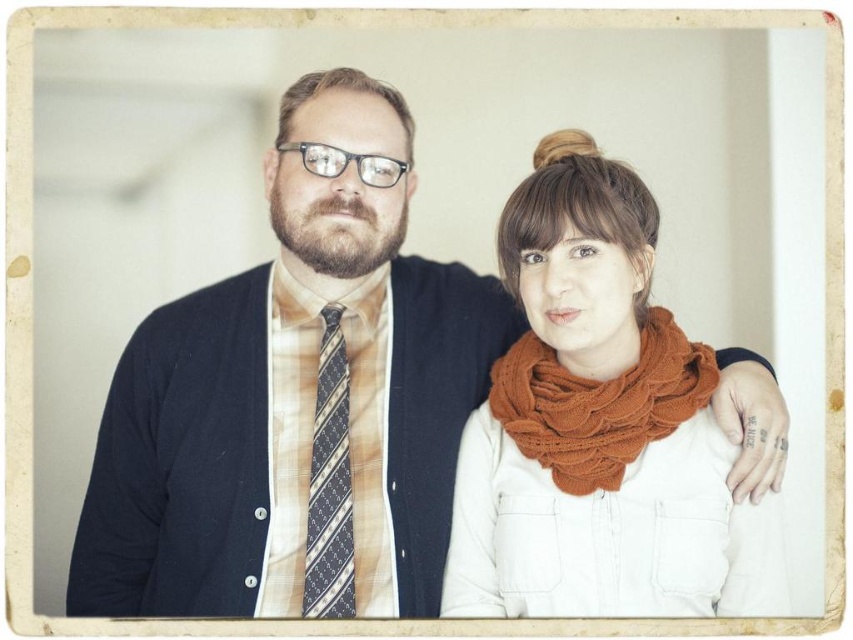
Question: Can you confirm if orange knitted scarf at center is positioned to the right of blue striped tie at center?

Choices:
 (A) yes
 (B) no

Answer: (A)

Question: Which point is farther to the camera?

Choices:
 (A) (346, 515)
 (B) (248, 550)
 (C) (766, 612)

Answer: (A)

Question: Does orange knitted scarf at center have a larger size compared to knitted orange scarf at center?

Choices:
 (A) no
 (B) yes

Answer: (B)

Question: Is knitted orange scarf at center to the left of blue striped tie at center from the viewer's perspective?

Choices:
 (A) yes
 (B) no

Answer: (B)

Question: Which object appears closest to the camera in this image?

Choices:
 (A) orange knitted scarf at center
 (B) knitted orange scarf at center

Answer: (A)

Question: Estimate the real-world distances between objects in this image. Which object is closer to the blue striped tie at center?

Choices:
 (A) matte black sweater at left
 (B) orange knitted scarf at center

Answer: (A)